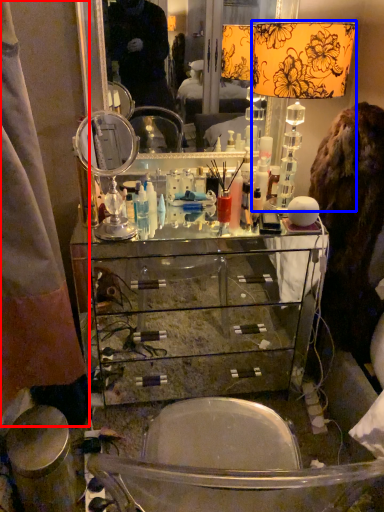
Question: Which object is further to the camera taking this photo, curtain (highlighted by a red box) or table lamp (highlighted by a blue box)?

Choices:
 (A) curtain
 (B) table lamp

Answer: (B)